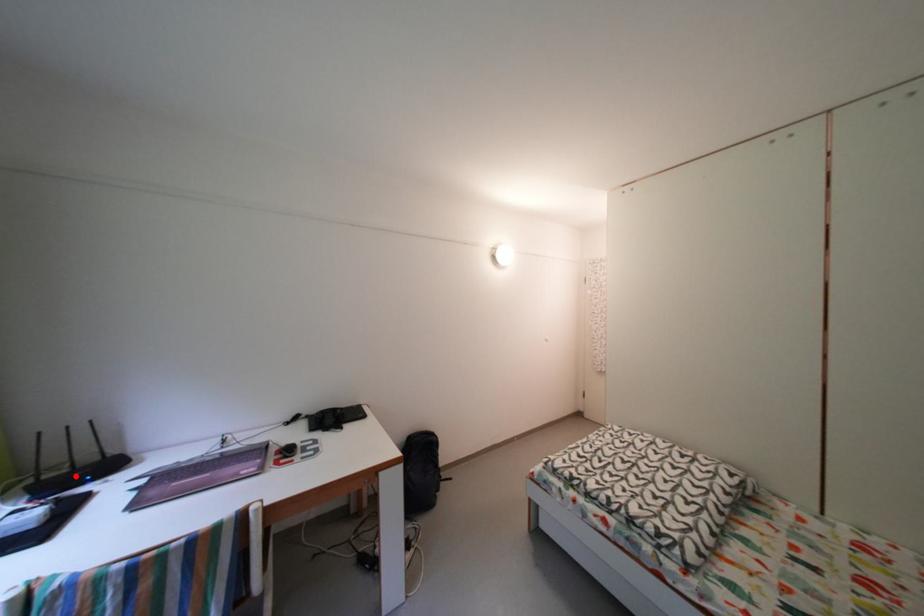
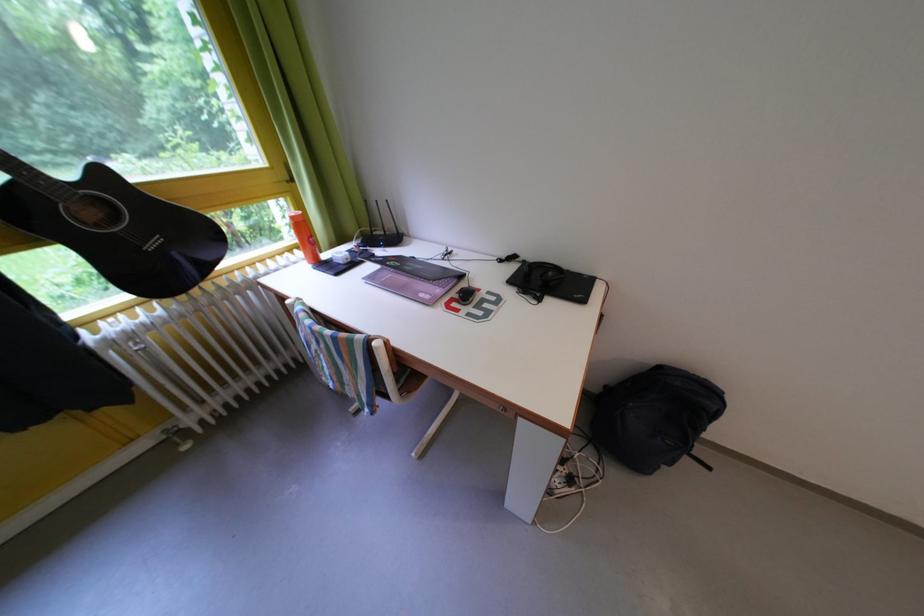
The point at the highlighted location is marked in the first image. Where is the corresponding point in the second image?

(392, 238)